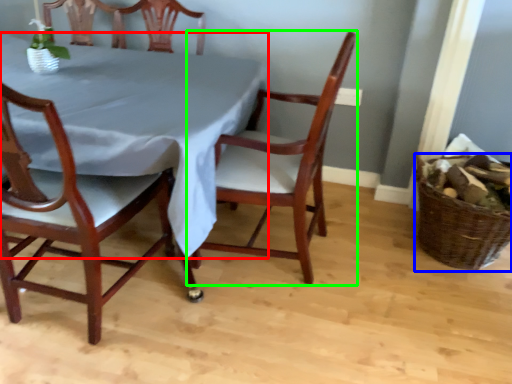
Question: Which object is positioned closest to tablecloth (highlighted by a red box)? Select from basket (highlighted by a blue box) and chair (highlighted by a green box).

Choices:
 (A) basket
 (B) chair

Answer: (B)